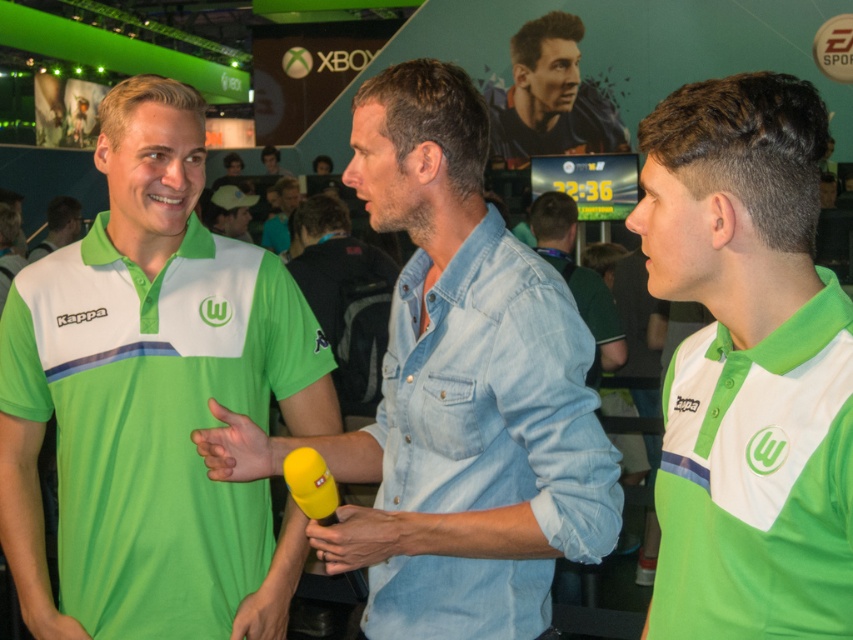
Which is above, denim shirt at center or green jersey at center?

green jersey at center is higher up.

Between point (587, 378) and point (62, 216), which one is positioned in front?

Point (587, 378)

The height and width of the screenshot is (640, 853). In order to click on denim shirt at center in this screenshot , I will do `click(578, 280)`.

Is point (77, 214) farther from camera compared to point (253, 198)?

No, (77, 214) is closer to viewer.

Which of these two, green jersey at center or white matte baseball cap at center, stands taller?

green jersey at center is taller.

Locate an element on the screen. green jersey at center is located at coordinates (57, 227).

Is light blue denim shirt at center to the right of denim shirt at center from the viewer's perspective?

In fact, light blue denim shirt at center is to the left of denim shirt at center.

Between light blue denim shirt at center and denim shirt at center, which one has less height?

light blue denim shirt at center

Is point (532, 433) farther from viewer compared to point (599, 291)?

No, (532, 433) is in front of (599, 291).

Where is `light blue denim shirt at center`? This screenshot has width=853, height=640. light blue denim shirt at center is located at coordinates (495, 396).